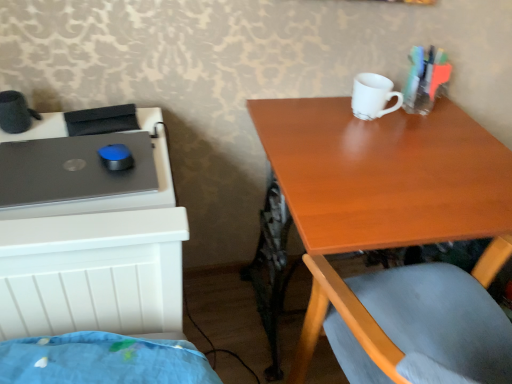
Question: Is white matte mug at upper center wider or thinner than translucent plastic markers at upper right?

Choices:
 (A) thin
 (B) wide

Answer: (B)

Question: Considering the positions of point (352, 92) and point (440, 66), is point (352, 92) closer or farther from the camera than point (440, 66)?

Choices:
 (A) farther
 (B) closer

Answer: (A)

Question: Which is farther from the wooden table at upper right?

Choices:
 (A) white matte mug at upper center
 (B) translucent plastic markers at upper right
 (C) matte black laptop at left

Answer: (C)

Question: Which of these objects is positioned closest to the wooden table at upper right?

Choices:
 (A) matte black laptop at left
 (B) translucent plastic markers at upper right
 (C) white matte mug at upper center

Answer: (C)